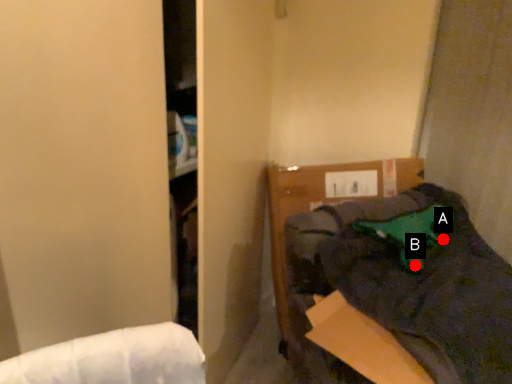
Question: Two points are circled on the image, labeled by A and B beside each circle. Which point is farther to the camera?

Choices:
 (A) A is further
 (B) B is further

Answer: (A)